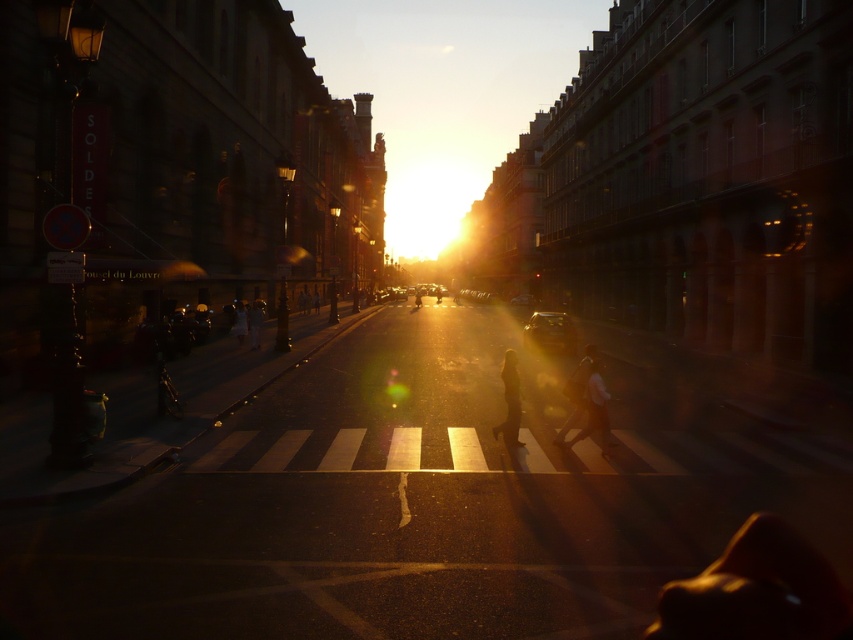
What do you see at coordinates (239, 323) in the screenshot?
I see `dark gray fabric pedestrian at center` at bounding box center [239, 323].

How distant is dark gray fabric pedestrian at center from dark blue jeans at center?

They are 22.52 meters apart.

Locate an element on the screen. The width and height of the screenshot is (853, 640). dark gray fabric pedestrian at center is located at coordinates (239, 323).

Can you confirm if light brown leather jacket at center is bigger than smooth skin pedestrian at center?

Correct, light brown leather jacket at center is larger in size than smooth skin pedestrian at center.

Can you confirm if light brown leather jacket at center is positioned below smooth skin pedestrian at center?

Yes, light brown leather jacket at center is below smooth skin pedestrian at center.

Does point (564, 429) come in front of point (316, 310)?

Yes, it is.

Locate an element on the screen. light brown leather jacket at center is located at coordinates (577, 392).

Can you confirm if golden hair at center is wider than light brown leather bag at center?

In fact, golden hair at center might be narrower than light brown leather bag at center.

Does golden hair at center appear on the right side of light brown leather bag at center?

Correct, you'll find golden hair at center to the right of light brown leather bag at center.

What are the coordinates of `golden hair at center` in the screenshot? It's located at (509, 401).

In order to click on golden hair at center in this screenshot , I will do `click(509, 401)`.